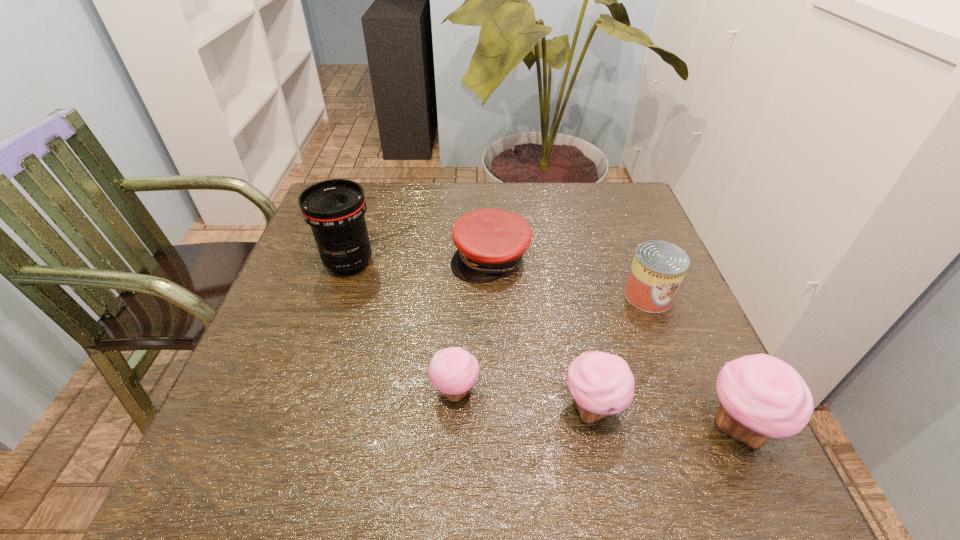
The height and width of the screenshot is (540, 960). In order to click on free space for a new cupcake on the left in this screenshot , I will do `click(326, 375)`.